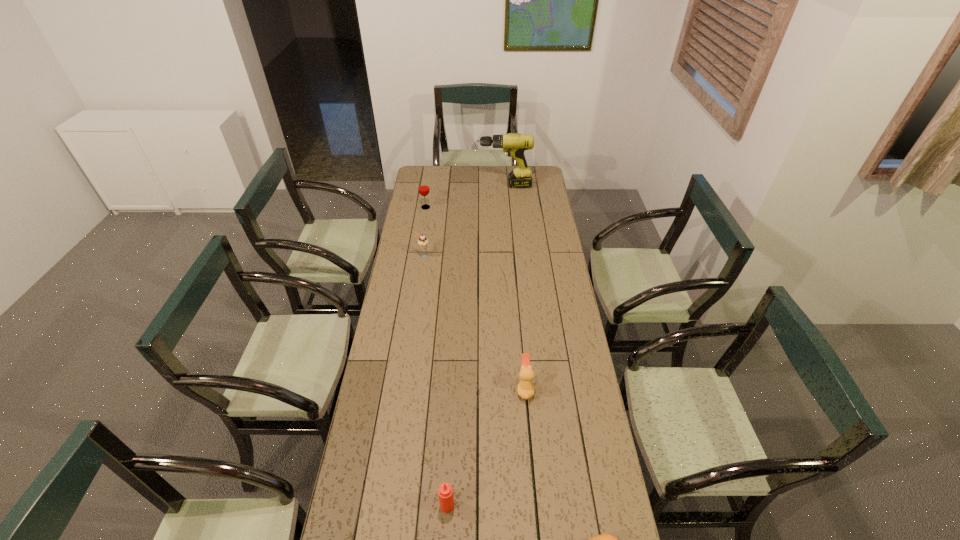
Where is `object that is at the right edge`? This screenshot has width=960, height=540. object that is at the right edge is located at coordinates (515, 144).

This screenshot has width=960, height=540. I want to click on object located in the far right corner section of the desktop, so click(x=515, y=144).

I want to click on vacant area at the far edge of the desktop, so point(472,182).

In the image, there is a desktop. At what (x,y) coordinates should I click in order to perform the action: click on vacant area at the left edge. Please return your answer as a coordinate pair (x, y). This screenshot has width=960, height=540. Looking at the image, I should click on (385, 341).

Image resolution: width=960 pixels, height=540 pixels. What are the coordinates of `vacant area at the right edge of the desktop` in the screenshot? It's located at (544, 303).

You are a GUI agent. You are given a task and a screenshot of the screen. Output one action in this format:
    pyautogui.click(x=<x>, y=<y>)
    Task: Click on the free space at the far left corner of the desktop
    The image size is (960, 540).
    Given the screenshot: What is the action you would take?
    pyautogui.click(x=436, y=182)

Where is `vacant point at the far right corner`? This screenshot has height=540, width=960. vacant point at the far right corner is located at coordinates pyautogui.click(x=544, y=174).

In order to click on blank region between the fifth tallest object and the icecream in this screenshot , I will do pyautogui.click(x=474, y=322).

You are a GUI agent. You are given a task and a screenshot of the screen. Output one action in this format:
    pyautogui.click(x=<x>, y=<y>)
    Task: Click on the vacant area between the fifth nearest object and the fourth nearest object
    Image resolution: width=960 pixels, height=540 pixels.
    Given the screenshot: What is the action you would take?
    pyautogui.click(x=424, y=232)

You are a GUI agent. You are given a task and a screenshot of the screen. Output one action in this format:
    pyautogui.click(x=<x>, y=<y>)
    Task: Click on the free space between the farthest object and the duck
    
    Given the screenshot: What is the action you would take?
    click(515, 287)